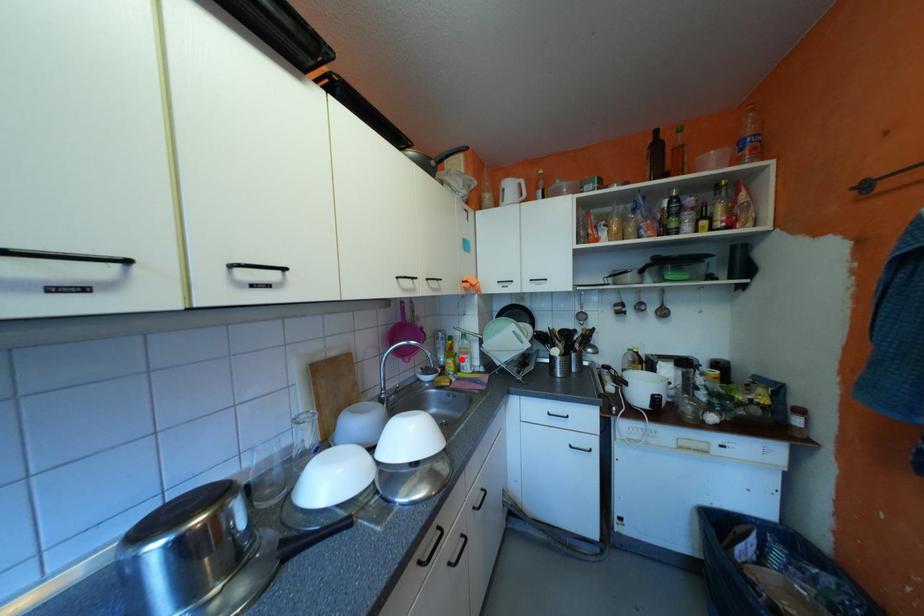
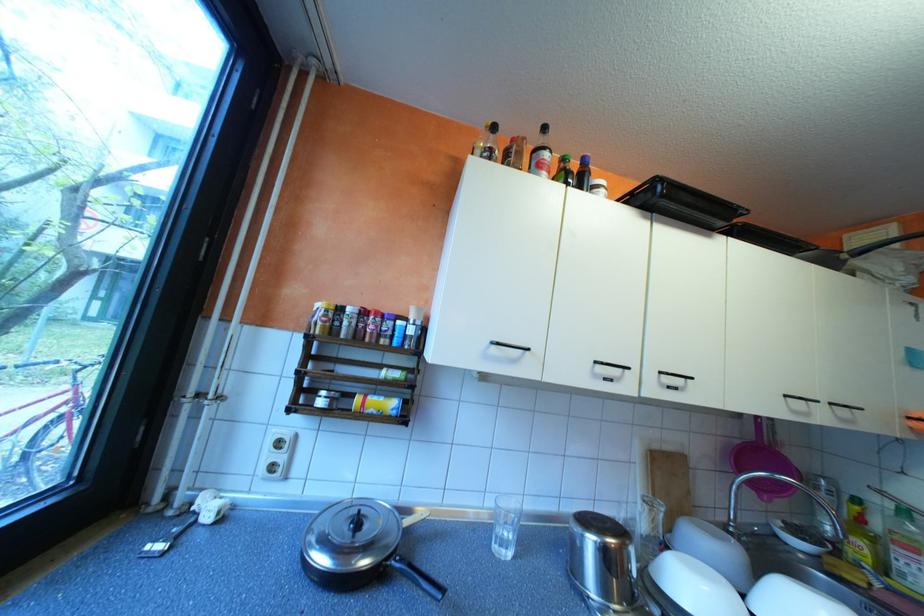
Question: A red point is marked in image1. In image2, is the corresponding 3D point closer to the camera or farther? Reply with the corresponding letter.

Choices:
 (A) The corresponding 3D point is closer.
 (B) The corresponding 3D point is farther.

Answer: (A)